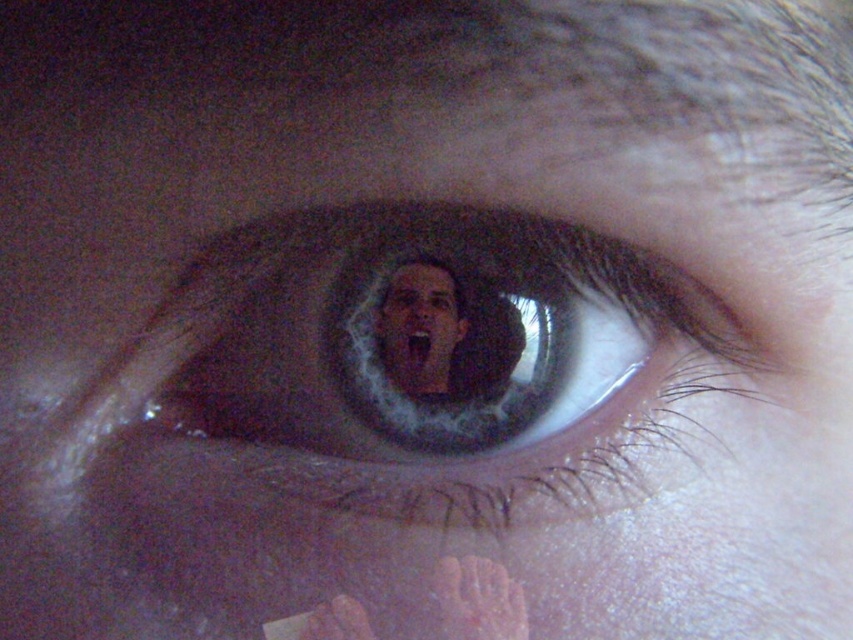
Is brown matte eye at center thinner than smooth skin face at center?

No, brown matte eye at center is not thinner than smooth skin face at center.

Can you confirm if brown matte eye at center is bigger than smooth skin face at center?

Yes.

Is point (589, 461) positioned before point (383, 333)?

No, it is not.

I want to click on brown matte eye at center, so click(x=430, y=364).